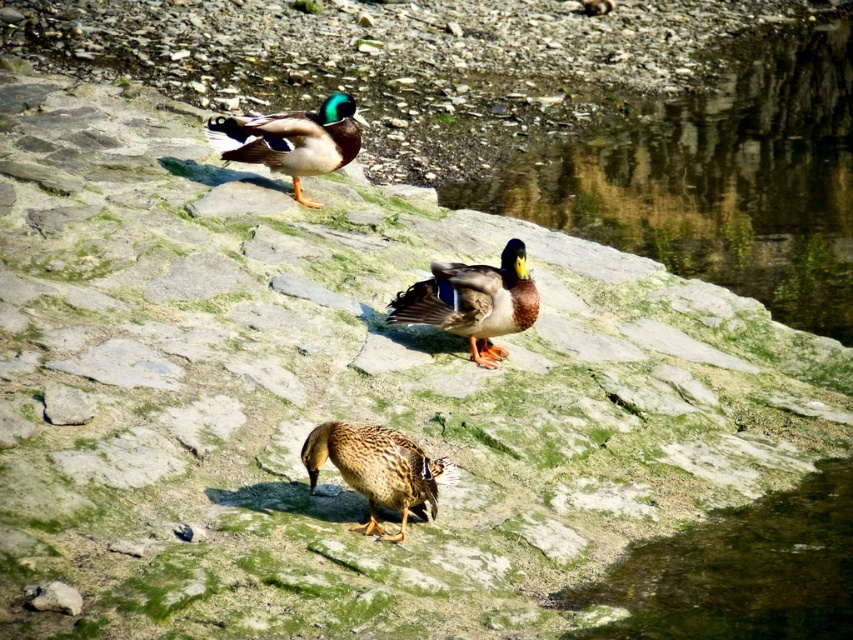
You are observing the ducks on the rocky surface. Which duck is positioned higher up on the rocks between the shiny brown duck at center and the brown speckled feathers at center?

The shiny brown duck at center is positioned higher up on the rocks compared to the brown speckled feathers at center, as it is located above it.

You are observing two ducks on the rocks. The shiny brown duck at center and the shiny green and brown duck at upper center. Which duck is shorter?

The shiny brown duck at center is shorter than the shiny green and brown duck at upper center.

You are a photographer aiming to capture the shiny brown duck at center in your shot. Given that your camera has a focal point at coordinates 0.5, 0.5, will the duck be centered in your photo?

The shiny brown duck at center is located at coordinates (473, 301), which is slightly to the left and below the camera focal point at (426, 320). Therefore, the duck will not be perfectly centered in the photo.